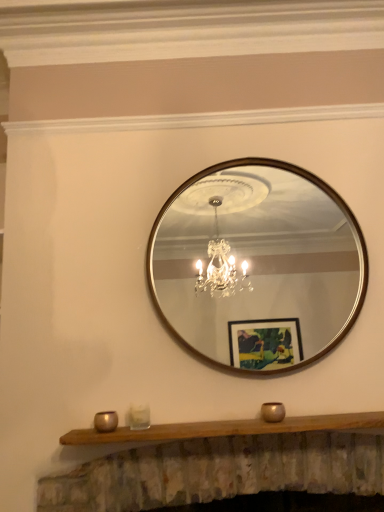
Locate an element on the screen. The height and width of the screenshot is (512, 384). empty space that is ontop of wooden mantle at center (from a real-world perspective) is located at coordinates (274, 420).